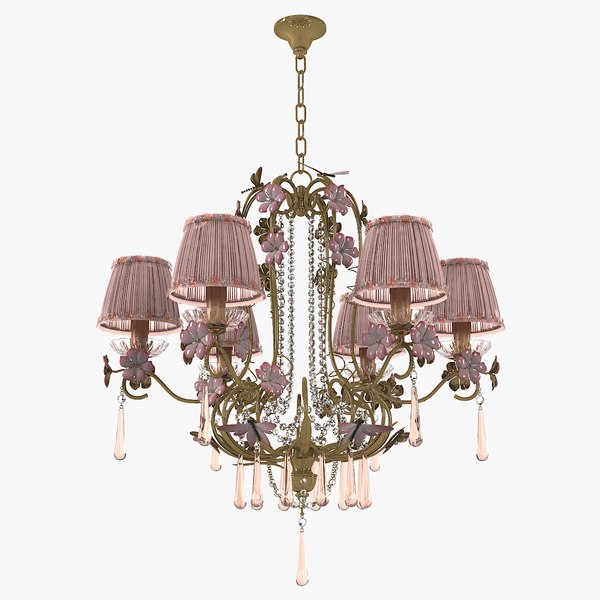
Image resolution: width=600 pixels, height=600 pixels. I want to click on light holder, so click(x=140, y=329), click(x=216, y=298), click(x=397, y=295), click(x=463, y=331).